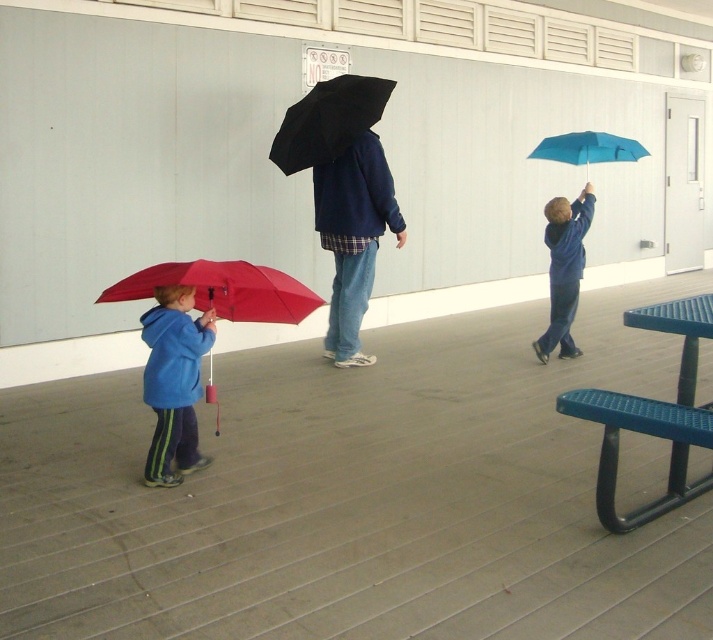
Between black matte umbrella at center and teal matte umbrella at upper right, which one appears on the right side from the viewer's perspective?

Positioned to the right is teal matte umbrella at upper right.

Is black matte umbrella at center taller than teal matte umbrella at upper right?

Yes, black matte umbrella at center is taller than teal matte umbrella at upper right.

Measure the distance between black matte umbrella at center and camera.

A distance of 18.79 feet exists between black matte umbrella at center and camera.

Find the location of `black matte umbrella at center`. black matte umbrella at center is located at coordinates (328, 120).

Does point (155, 408) lie behind point (553, 253)?

No, (155, 408) is closer to viewer.

Does matte blue jacket at lower left have a lesser width compared to blue matte jacket at upper right?

Yes, matte blue jacket at lower left is thinner than blue matte jacket at upper right.

Is point (195, 460) closer to viewer compared to point (558, 241)?

Yes, point (195, 460) is closer to viewer.

Identify the location of matte blue jacket at lower left. (173, 381).

Does point (334, 278) lie in front of point (366, 90)?

No.

Which is in front, point (359, 189) or point (319, 164)?

Point (359, 189)

The image size is (713, 640). Identify the location of matte blue hoodie at center. (353, 237).